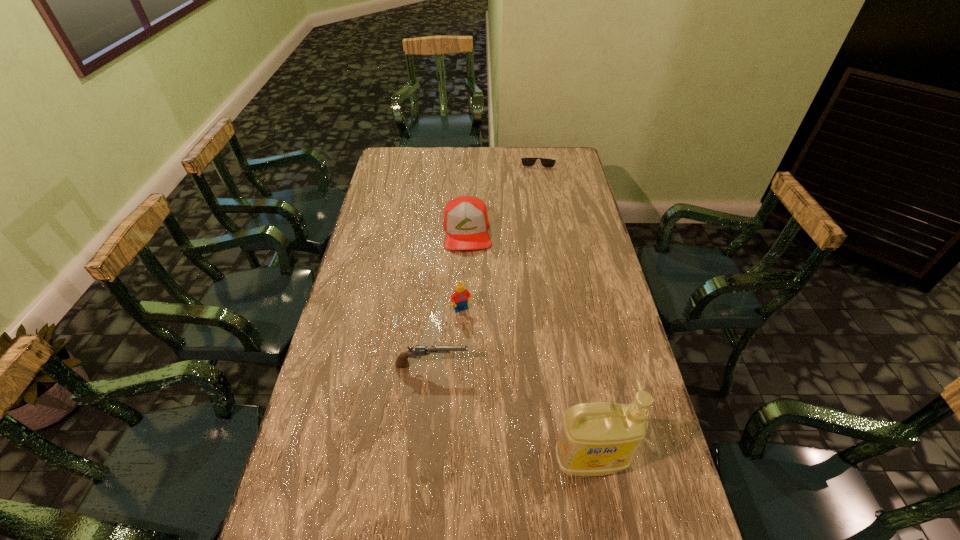
Where is `object that is the fourth closest to the nearest object`? The width and height of the screenshot is (960, 540). object that is the fourth closest to the nearest object is located at coordinates pos(545,162).

Where is `vacant region that satisfies the following two spatial constraints: 1. on the front side of the Lego; 2. on the right side of the detergent`? vacant region that satisfies the following two spatial constraints: 1. on the front side of the Lego; 2. on the right side of the detergent is located at coordinates (457, 460).